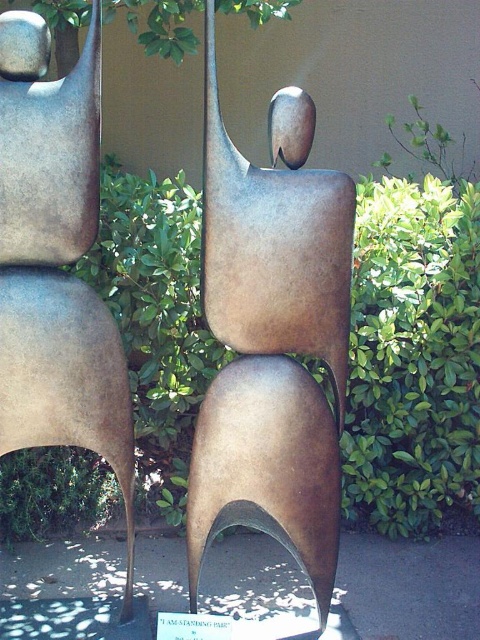
Is bronze sculpture at center to the right of matte bronze figure at center from the viewer's perspective?

Yes, bronze sculpture at center is to the right of matte bronze figure at center.

Image resolution: width=480 pixels, height=640 pixels. I want to click on bronze sculpture at center, so click(272, 339).